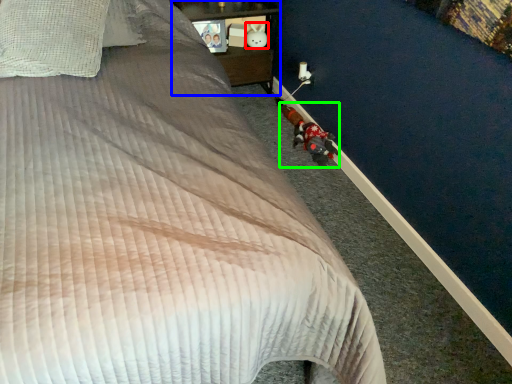
Question: Estimate the real-world distances between objects in this image. Which object is farther from toy (highlighted by a red box), furniture (highlighted by a blue box) or toy (highlighted by a green box)?

Choices:
 (A) furniture
 (B) toy

Answer: (B)